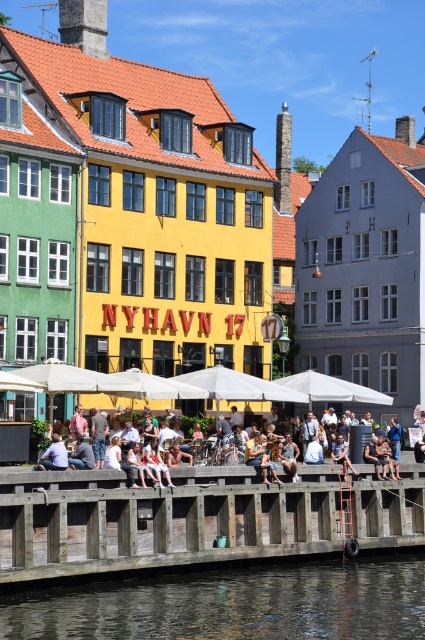
Where is `wooden dock at center`? wooden dock at center is located at coordinates (195, 518).

Which is behind, point (212, 534) or point (260, 468)?

The point (260, 468) is behind.

Locate an element on the screen. This screenshot has width=425, height=640. wooden dock at center is located at coordinates (195, 518).

Is transparent water at lower center further to camera compared to light blue denim jeans at center?

No, transparent water at lower center is closer to the viewer.

What do you see at coordinates (229, 602) in the screenshot?
I see `transparent water at lower center` at bounding box center [229, 602].

Find the location of a particular element. This screenshot has height=640, width=425. transparent water at lower center is located at coordinates (229, 602).

Which is above, wooden dock at center or transparent water at lower center?

wooden dock at center is higher up.

Who is more distant from viewer, (325, 493) or (82, 637)?

The point (325, 493) is more distant.

Locate an element on the screen. The height and width of the screenshot is (640, 425). wooden dock at center is located at coordinates (195, 518).